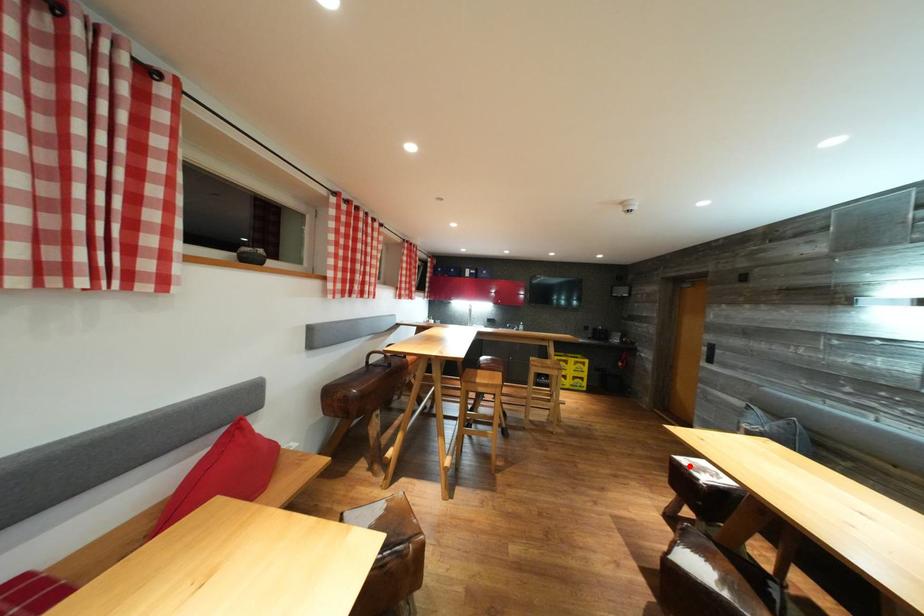
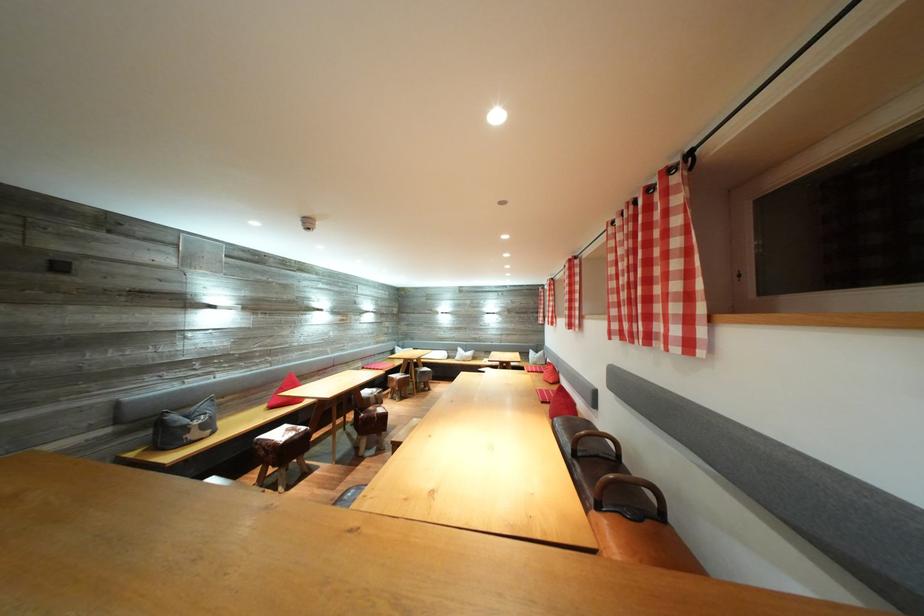
Question: I am providing you with two images of the same scene from different viewpoints. A red point is marked on the first image. Can you still see the location of the red point in image 2?

Choices:
 (A) Yes
 (B) No

Answer: (B)